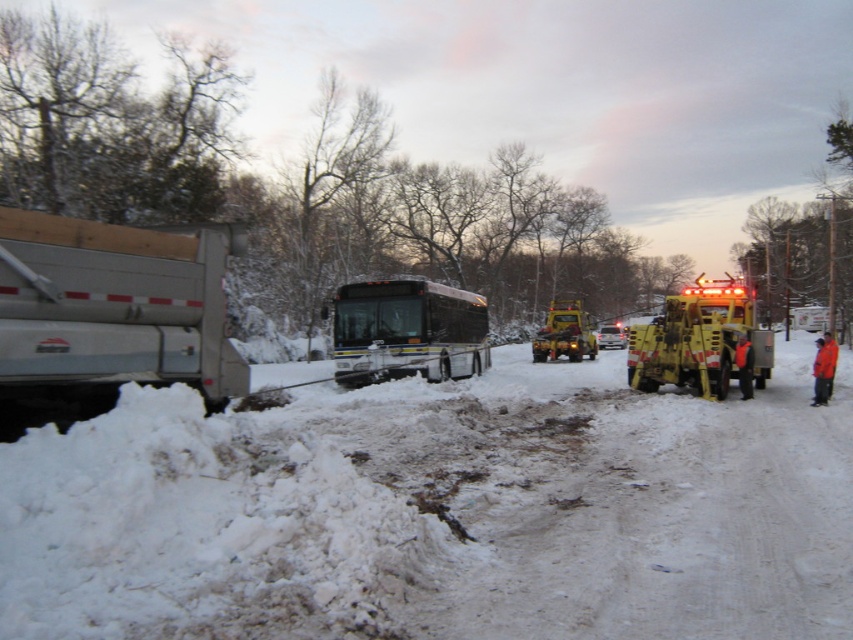
Question: Among these points, which one is nearest to the camera?

Choices:
 (A) (726, 385)
 (B) (109, 284)

Answer: (B)

Question: Which point is farther to the camera?

Choices:
 (A) yellow rubber fire truck at center
 (B) black rubber bus at center
 (C) silver metallic dump truck at left

Answer: (A)

Question: Considering the real-world distances, which object is closest to the black rubber bus at center?

Choices:
 (A) white powdery snow at lower left
 (B) silver metallic dump truck at left
 (C) yellow rubber snowplow at right
 (D) yellow rubber fire truck at center

Answer: (A)

Question: Is yellow rubber snowplow at right below yellow rubber fire truck at center?

Choices:
 (A) yes
 (B) no

Answer: (A)

Question: Does white powdery snow at lower left appear on the left side of black rubber bus at center?

Choices:
 (A) yes
 (B) no

Answer: (B)

Question: Can you confirm if white powdery snow at lower left is positioned to the right of silver metallic dump truck at left?

Choices:
 (A) yes
 (B) no

Answer: (A)